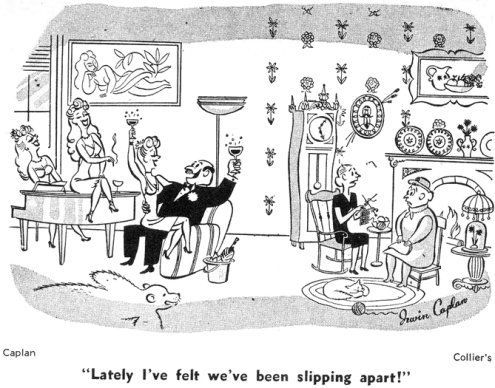
I want to click on bearskin rug, so point(103,307).